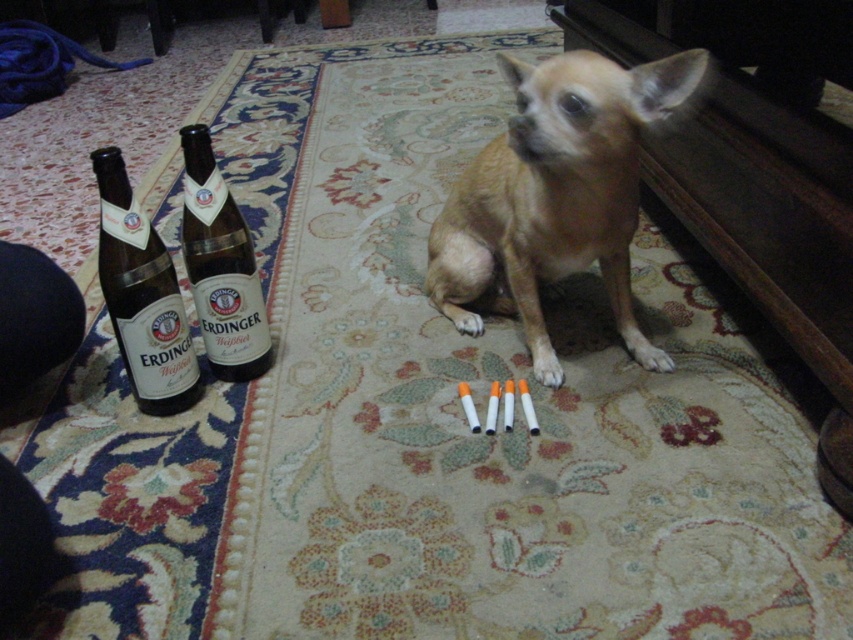
Which is in front, point (577, 58) or point (210, 339)?

Point (577, 58)

Is light brown fur at center to the left of brown glass bottle at left from the viewer's perspective?

No, light brown fur at center is not to the left of brown glass bottle at left.

Find the location of `light brown fur at center`. light brown fur at center is located at coordinates (555, 195).

Image resolution: width=853 pixels, height=640 pixels. I want to click on light brown fur at center, so click(x=555, y=195).

Is light brown fur at center bigger than brown glass beer bottle at left?

Yes, light brown fur at center is bigger than brown glass beer bottle at left.

Which is below, light brown fur at center or brown glass beer bottle at left?

Positioned lower is brown glass beer bottle at left.

Which is behind, point (448, 317) or point (119, 216)?

Point (448, 317)

Image resolution: width=853 pixels, height=640 pixels. Find the location of `light brown fur at center`. light brown fur at center is located at coordinates (555, 195).

Between brown glass beer bottle at left and brown glass bottle at left, which one is positioned higher?

brown glass bottle at left is above.

Is point (126, 294) closer to camera compared to point (196, 164)?

Yes, it is in front of point (196, 164).

The image size is (853, 640). What do you see at coordinates (142, 296) in the screenshot?
I see `brown glass beer bottle at left` at bounding box center [142, 296].

Find the location of a particular element. Image resolution: width=853 pixels, height=640 pixels. brown glass beer bottle at left is located at coordinates (142, 296).